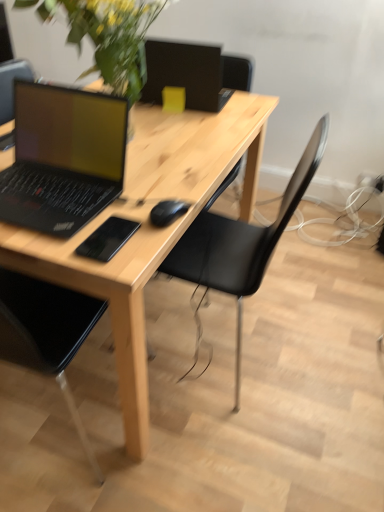
In order to click on unoccupied area in front of black matte mouse at center in this screenshot , I will do `click(143, 245)`.